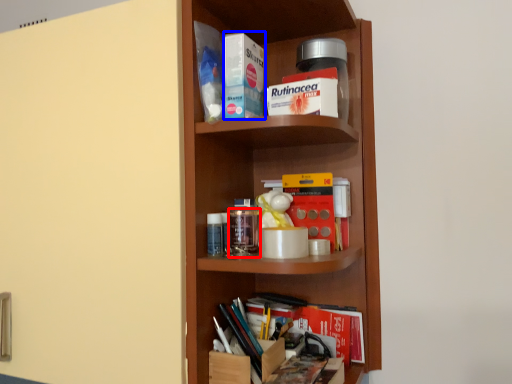
Question: Which object is closer to the camera taking this photo, glass jar (highlighted by a red box) or book (highlighted by a blue box)?

Choices:
 (A) glass jar
 (B) book

Answer: (B)